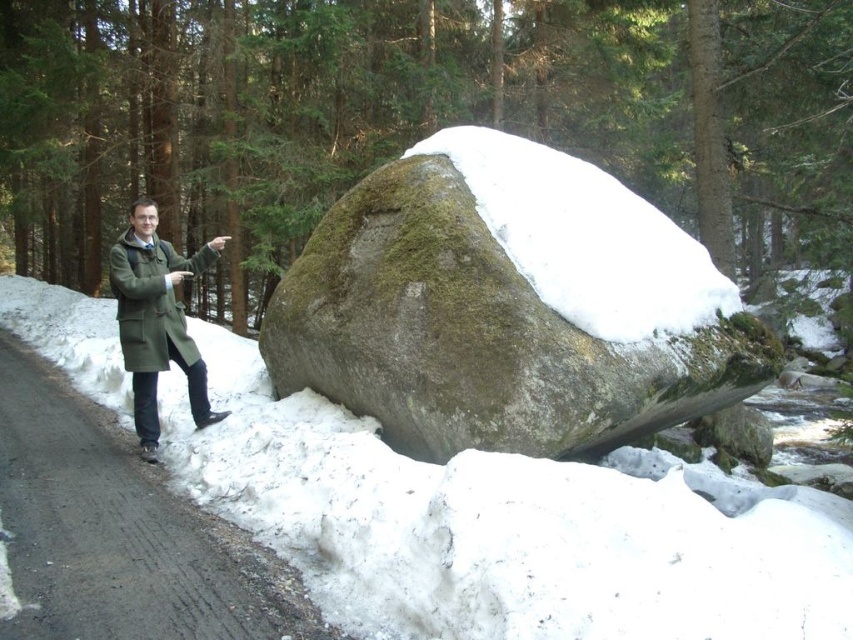
Is white fluffy snow at center wider than green mossy rock at center?

Yes.

Does white fluffy snow at center appear on the right side of green mossy rock at center?

No, white fluffy snow at center is not to the right of green mossy rock at center.

This screenshot has height=640, width=853. What do you see at coordinates (503, 528) in the screenshot?
I see `white fluffy snow at center` at bounding box center [503, 528].

The width and height of the screenshot is (853, 640). Find the location of `white fluffy snow at center`. white fluffy snow at center is located at coordinates (503, 528).

Does green mossy rock at center have a greater width compared to green wool coat at left?

Yes, green mossy rock at center is wider than green wool coat at left.

Does point (521, 237) come farther from viewer compared to point (126, 284)?

No, it is in front of (126, 284).

Does point (415, 268) come closer to viewer compared to point (126, 301)?

Yes, it is.

Locate an element on the screen. The image size is (853, 640). green mossy rock at center is located at coordinates pyautogui.click(x=509, y=307).

Between point (677, 557) and point (142, 417), which one is positioned behind?

Point (142, 417)

Identify the location of white fluffy snow at center. (503, 528).

Does point (616, 588) come in front of point (189, 269)?

Yes, it is.

The width and height of the screenshot is (853, 640). Identify the location of white fluffy snow at center. (503, 528).